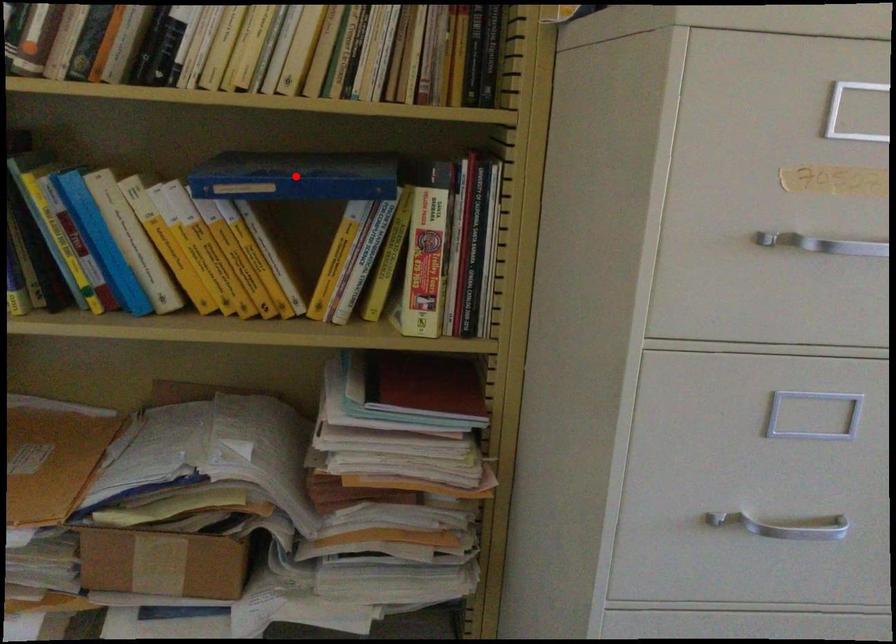
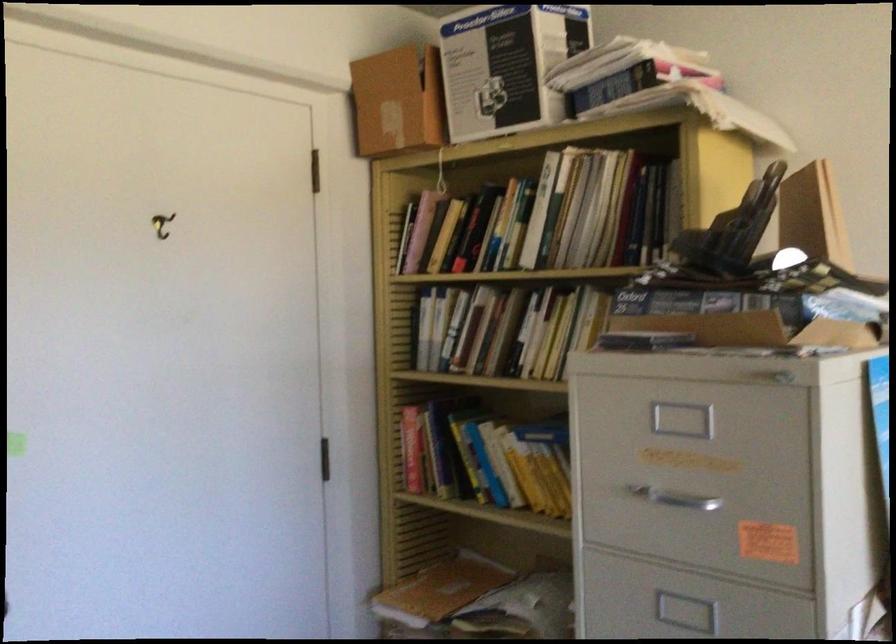
Question: I am providing you with two images of the same scene from different viewpoints. A red point is marked on the first image. At the location where the point appears in image 1, is it still visible in image 2?

Choices:
 (A) Yes
 (B) No

Answer: (B)